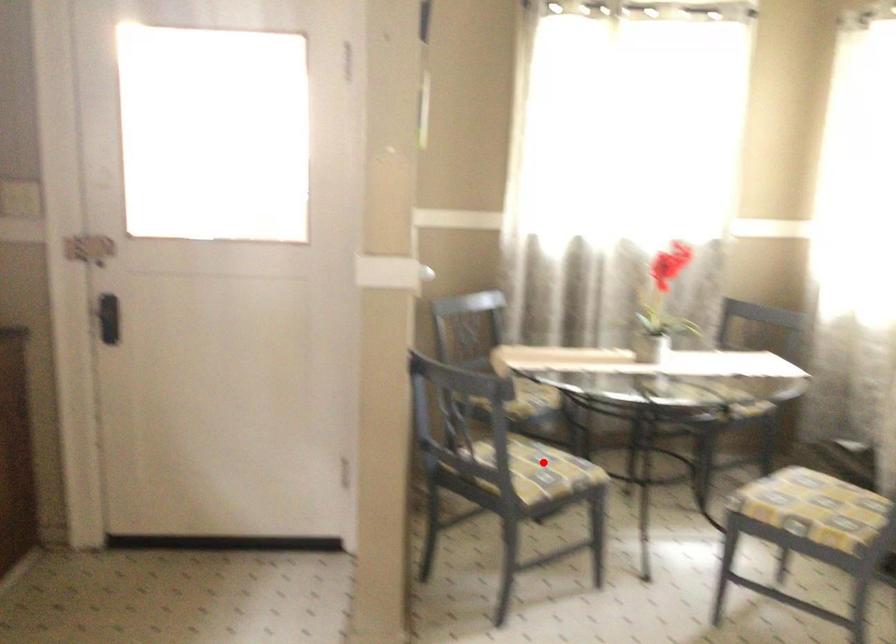
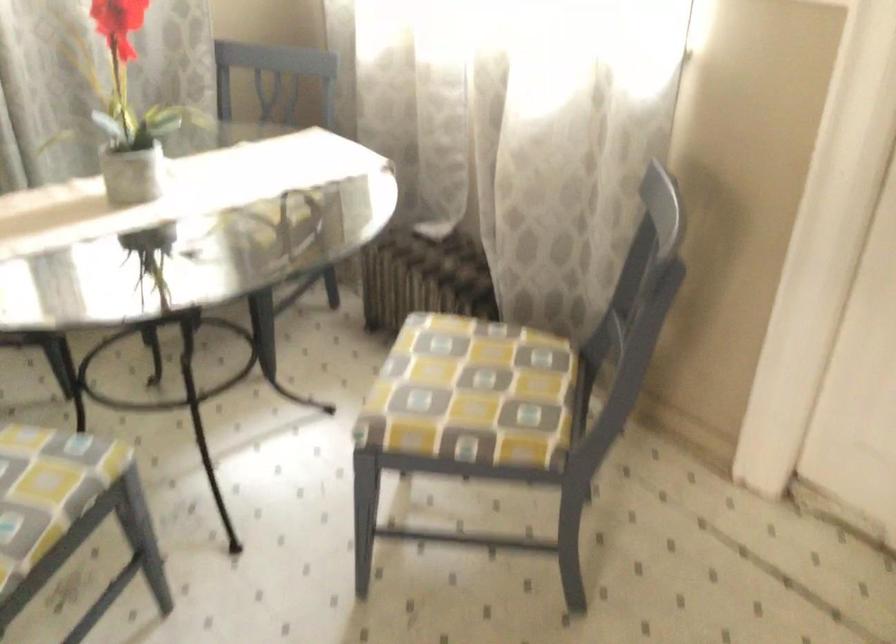
Question: I am providing you with two images of the same scene from different viewpoints. In image1, a red point is highlighted. Considering the same 3D point in image2, which of the following is correct?

Choices:
 (A) It is closer
 (B) It is farther

Answer: (A)